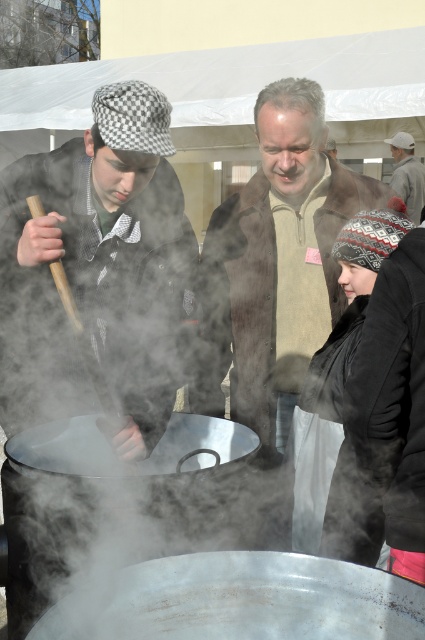
Which hat is positioned to the left when comparing the checkered fabric hat at left and the gray knit hat at upper right?

The checkered fabric hat at left is positioned to the left of the gray knit hat at upper right.

You are standing at the point marked by the coordinate point at [51,230]. You want to move to the large metal pot in the foreground. Is the distance between you and the pot sufficient to allow you to walk directly to it without needing to detour around any obstacles?

The distance between you and the large metal pot is 1.81 meters, which is sufficient to walk directly to it without needing to detour around obstacles.